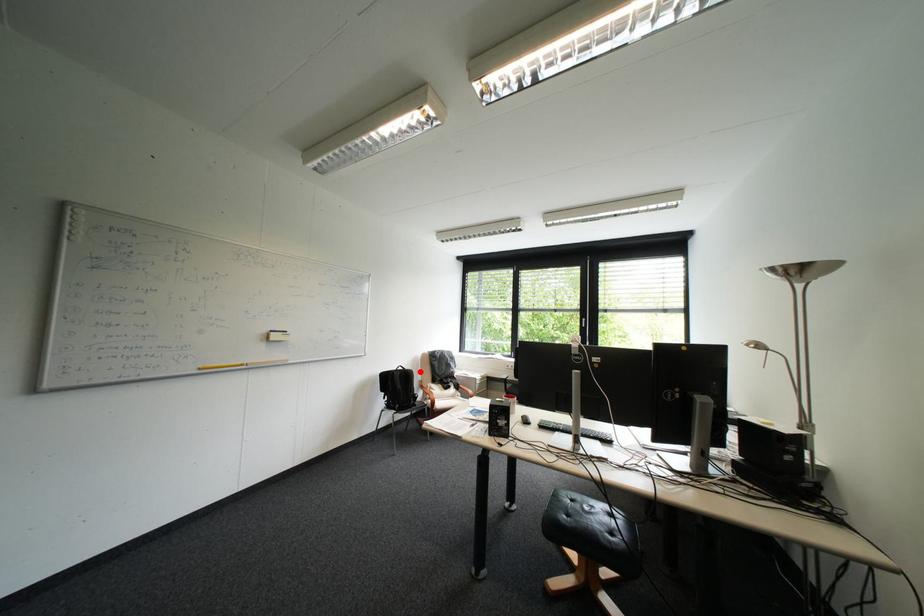
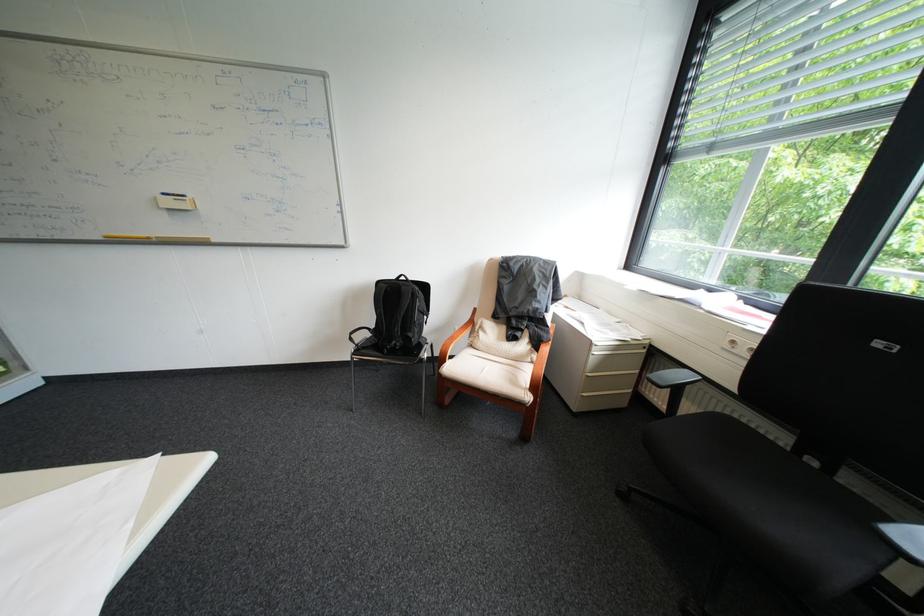
Question: I am providing you with two images of the same scene from different viewpoints. A red point is marked on the first image. Is the red point's position out of view in image 2?

Choices:
 (A) Yes
 (B) No

Answer: (B)